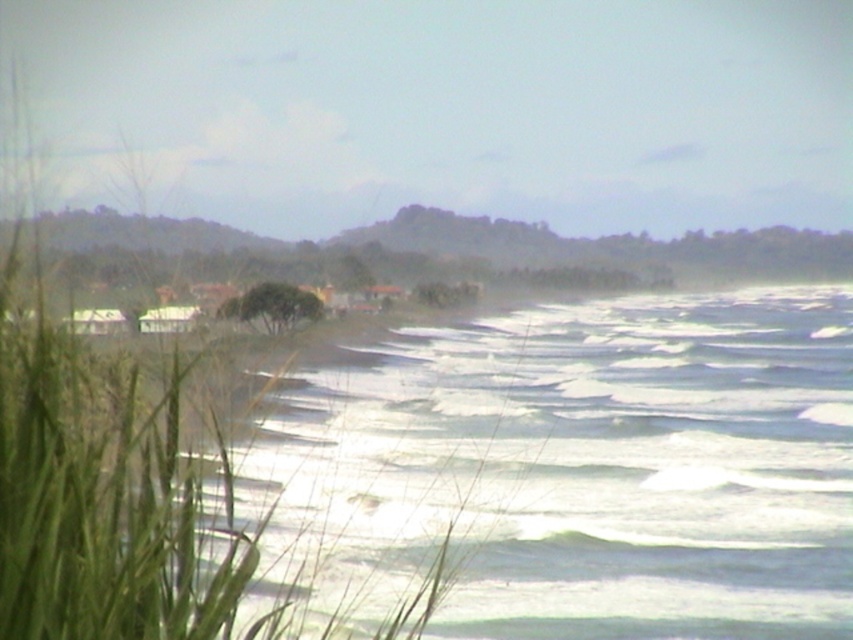
Question: Is green grass at left closer to the viewer compared to green leafy tree at center?

Choices:
 (A) yes
 (B) no

Answer: (A)

Question: Does green grass at left appear on the left side of green leafy tree at center?

Choices:
 (A) no
 (B) yes

Answer: (A)

Question: Which point is farther to the camera?

Choices:
 (A) (251, 316)
 (B) (148, 515)

Answer: (A)

Question: Which of the following is the closest to the observer?

Choices:
 (A) green leafy tree at center
 (B) green grass at left

Answer: (B)

Question: Is green grass at left bigger than green leafy tree at center?

Choices:
 (A) no
 (B) yes

Answer: (A)